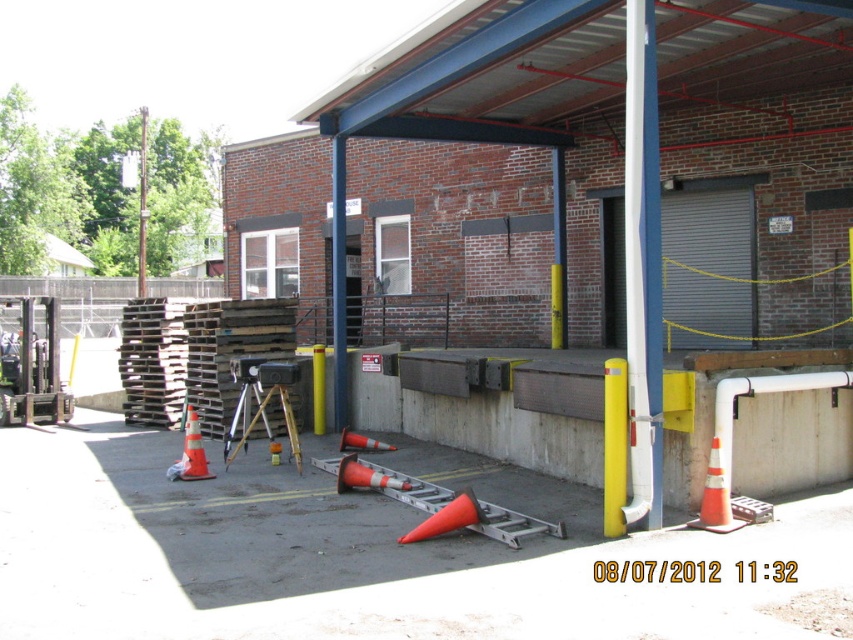
Question: Is yellow matte pole at center above orange reflective cone at center?

Choices:
 (A) no
 (B) yes

Answer: (B)

Question: Estimate the real-world distances between objects in this image. Which object is farther from the brushed metal pole at upper center?

Choices:
 (A) orange reflective cone at center
 (B) yellow matte pole at center
 (C) yellow/yellowish metal pole at center
 (D) orange reflective cone at lower right

Answer: (B)

Question: Estimate the real-world distances between objects in this image. Which object is closer to the orange reflective cone at lower right?

Choices:
 (A) orange reflective cone at center
 (B) brushed metal pole at upper center
 (C) yellow matte pole at center

Answer: (C)

Question: In this image, where is yellow/yellowish metal pole at center located relative to orange reflective cone at lower right?

Choices:
 (A) below
 (B) above

Answer: (B)

Question: Can you confirm if yellow matte pole at center is positioned to the right of brushed metal pole at upper center?

Choices:
 (A) no
 (B) yes

Answer: (B)

Question: Which point is farther to the camera?

Choices:
 (A) (717, 516)
 (B) (144, 200)
 (C) (196, 451)

Answer: (B)